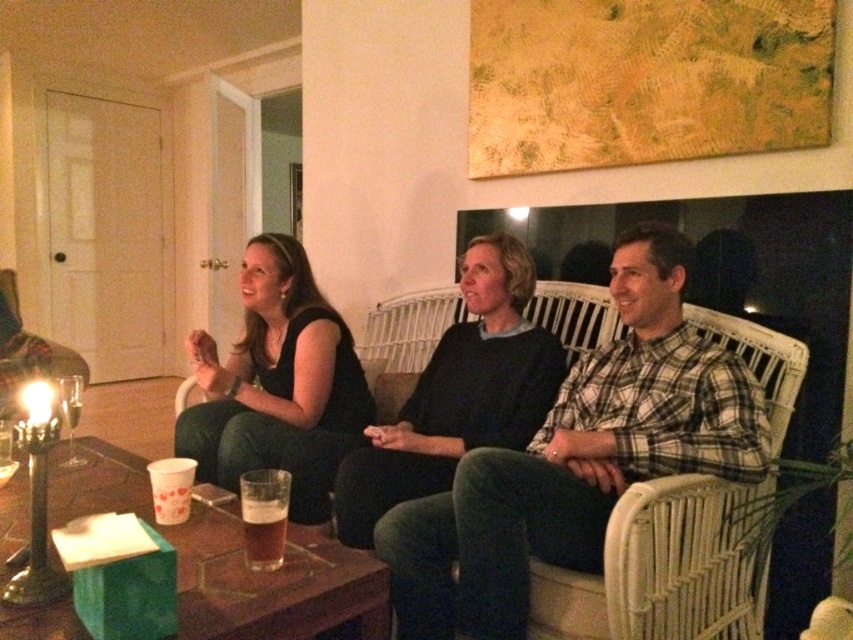
You are a fashion designer observing the scene. You need to determine which clothing item takes up more space visually between the black matte dress at center and the dark gray sweater at center. Which one is wider?

The dark gray sweater at center is wider than the black matte dress at center.

You are taking a photo of the scene and want to focus on both point (308,468) and point (248,568). Which point should you focus on first to ensure both are in focus?

You should focus on point (308,468) first because it is closer to the camera than point (248,568). By focusing on the closer point, the depth of field may also cover the farther point, ensuring both are in focus.